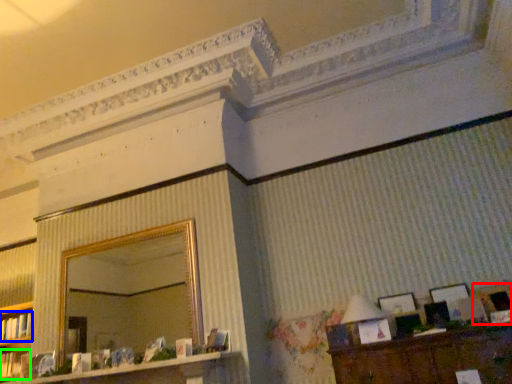
Question: Considering the real-world distances, which object is closest to picture frame (highlighted by a red box)? book (highlighted by a blue box) or book (highlighted by a green box).

Choices:
 (A) book
 (B) book

Answer: (B)